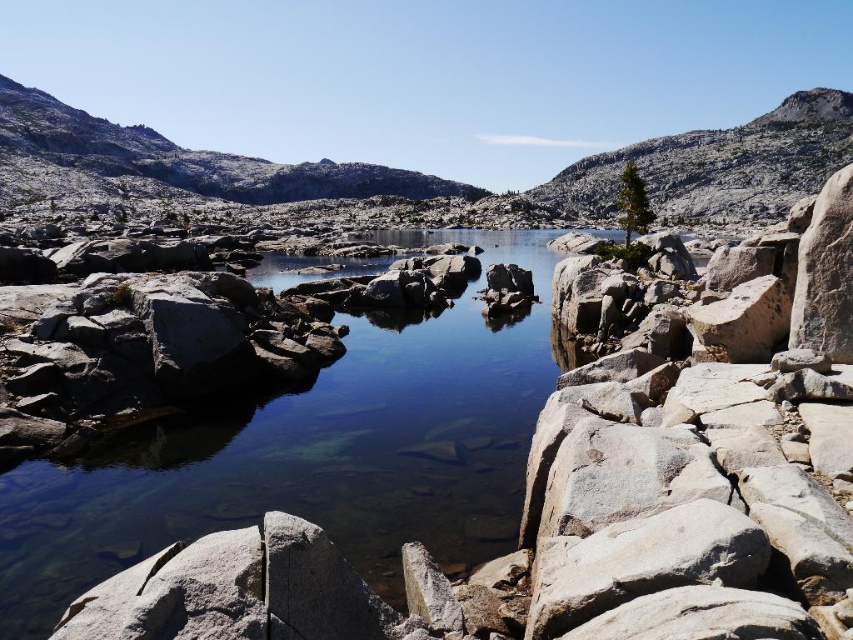
Question: Is gray granite mountain at center to the left of gray granite mountain at upper right from the viewer's perspective?

Choices:
 (A) yes
 (B) no

Answer: (A)

Question: Which point is closer to the camera?

Choices:
 (A) gray granite mountain at upper right
 (B) gray granite mountain at center

Answer: (B)

Question: Does gray granite mountain at center appear over gray granite mountain at upper right?

Choices:
 (A) yes
 (B) no

Answer: (A)

Question: Is gray granite mountain at center to the left of gray granite mountain at upper right from the viewer's perspective?

Choices:
 (A) no
 (B) yes

Answer: (B)

Question: Which object appears closest to the camera in this image?

Choices:
 (A) gray granite mountain at upper right
 (B) gray granite mountain at center

Answer: (B)